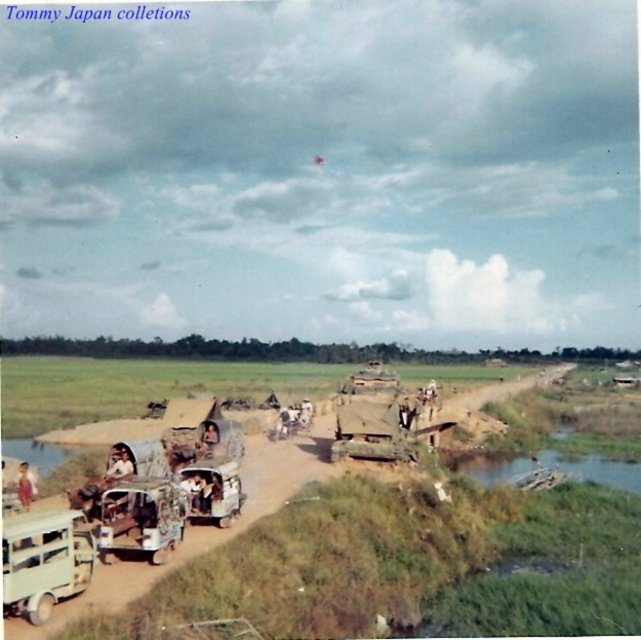
You are a photographer standing at the edge of the dirt road. You want to take a photo that includes both the light beige fabric truck at lower left and the light brown leather jacket at lower left. Which object should you zoom in on to ensure both are in the frame without moving your position?

You should zoom in on the light beige fabric truck at lower left because it is wider than the light brown leather jacket at lower left, so focusing on it will help include both objects in the frame.

You are standing on the dirt road and want to walk from point (203, 445) to point (29, 472). Which direction should you face to walk towards the closer point?

Point (29, 472) is closer to the viewer than point (203, 445). Therefore, to walk towards the closer point (29, 472), you should face downwards.